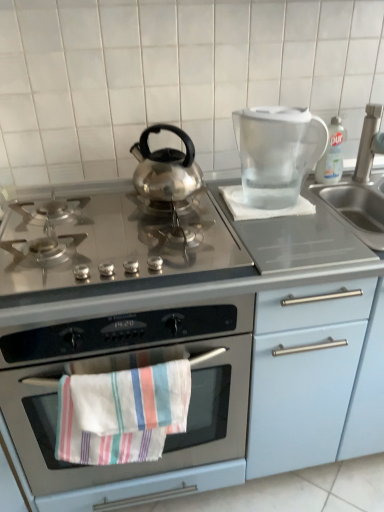
Question: Is transparent plastic pitcher at upper right bigger than satin nickel faucet at right?

Choices:
 (A) yes
 (B) no

Answer: (A)

Question: Is transparent plastic pitcher at upper right at the right side of satin nickel faucet at right?

Choices:
 (A) no
 (B) yes

Answer: (A)

Question: Is transparent plastic pitcher at upper right not close to satin nickel faucet at right?

Choices:
 (A) yes
 (B) no

Answer: (B)

Question: Is transparent plastic pitcher at upper right in contact with satin nickel faucet at right?

Choices:
 (A) no
 (B) yes

Answer: (A)

Question: Is transparent plastic pitcher at upper right wider than satin nickel faucet at right?

Choices:
 (A) yes
 (B) no

Answer: (A)

Question: In the image, is clear plastic bottle at upper right positioned in front of or behind stainless steel oven at center?

Choices:
 (A) behind
 (B) front

Answer: (A)

Question: From the image's perspective, is clear plastic bottle at upper right above or below stainless steel oven at center?

Choices:
 (A) above
 (B) below

Answer: (A)

Question: From a real-world perspective, is clear plastic bottle at upper right above or below stainless steel oven at center?

Choices:
 (A) below
 (B) above

Answer: (B)

Question: Would you say clear plastic bottle at upper right is to the left or to the right of stainless steel oven at center in the picture?

Choices:
 (A) right
 (B) left

Answer: (A)

Question: Considering the positions of point (145, 422) and point (374, 140), is point (145, 422) closer or farther from the camera than point (374, 140)?

Choices:
 (A) farther
 (B) closer

Answer: (B)

Question: From the image's perspective, relative to satin nickel faucet at right, is striped cotton towel at center above or below?

Choices:
 (A) below
 (B) above

Answer: (A)

Question: Considering the positions of striped cotton towel at center and satin nickel faucet at right in the image, is striped cotton towel at center wider or thinner than satin nickel faucet at right?

Choices:
 (A) thin
 (B) wide

Answer: (A)

Question: Relative to satin nickel faucet at right, is striped cotton towel at center in front or behind?

Choices:
 (A) front
 (B) behind

Answer: (A)

Question: Is stainless steel gas stove at center in front of or behind transparent plastic pitcher at upper right in the image?

Choices:
 (A) behind
 (B) front

Answer: (B)

Question: Is stainless steel gas stove at center spatially inside transparent plastic pitcher at upper right, or outside of it?

Choices:
 (A) inside
 (B) outside

Answer: (B)